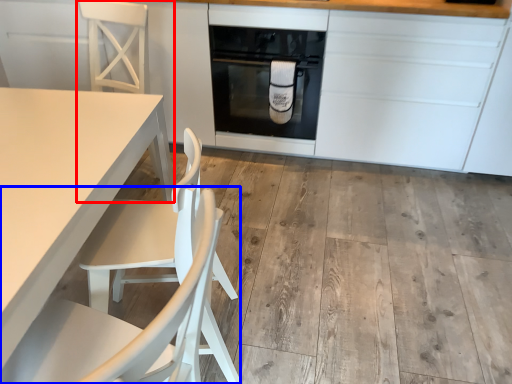
Question: Among these objects, which one is nearest to the camera, chair (highlighted by a red box) or chair (highlighted by a blue box)?

Choices:
 (A) chair
 (B) chair

Answer: (B)